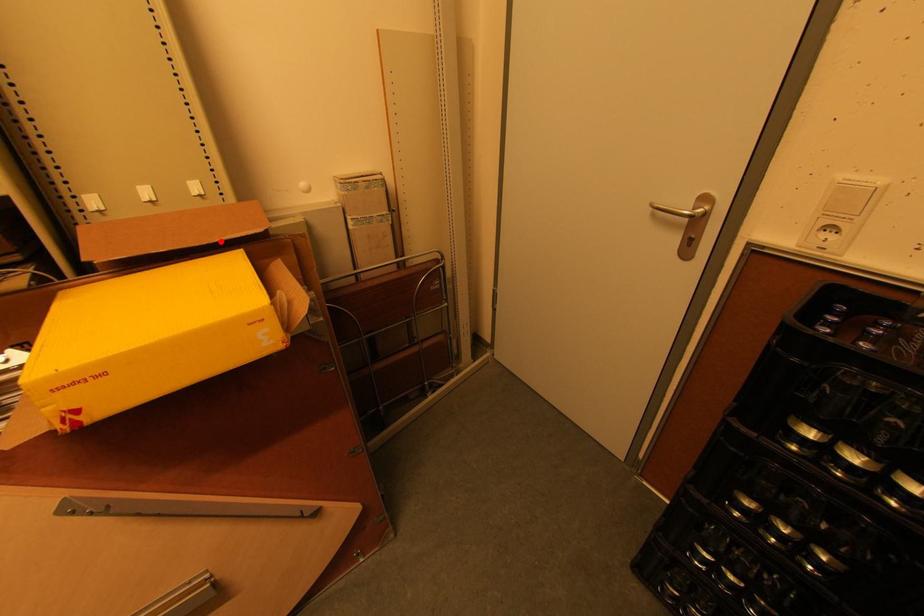
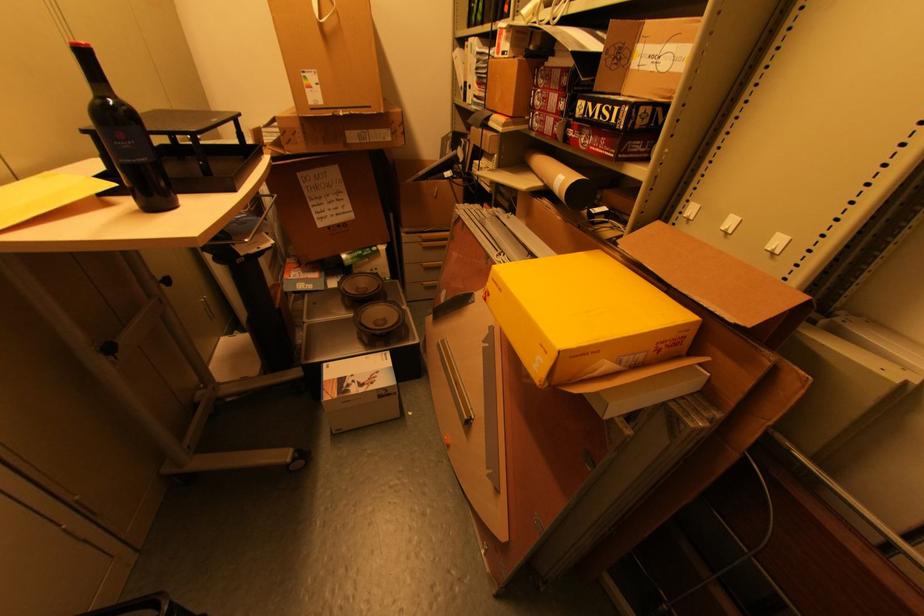
Question: I am providing you with two images of the same scene from different viewpoints. A red point is marked on the first image. Is the red point's position out of view in image 2?

Choices:
 (A) Yes
 (B) No

Answer: (B)